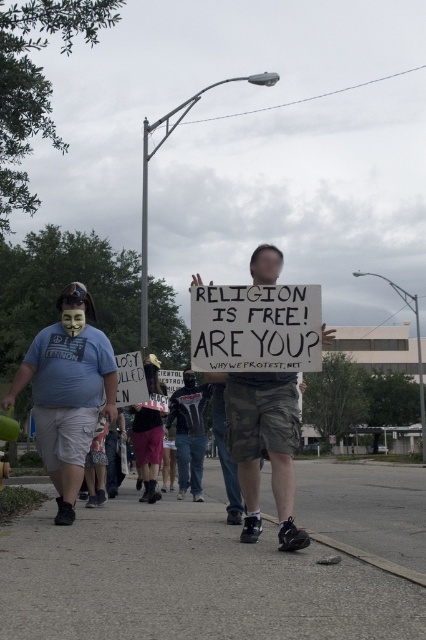
You are a photographer standing at the edge of the protest area. You want to capture a photo that includes both the gray asphalt pavement at lower center and the matte cardboard sign at center. Which object should you focus on first if you want both to be in sharp focus?

The gray asphalt pavement at lower center is larger in size than the matte cardboard sign at center, so focusing on the larger object first would ensure both are in sharp focus.

You are a photographer at the protest. You want to capture the matte cardboard sign at center without including the gray asphalt pavement at lower center in the frame. Is this possible?

The gray asphalt pavement at lower center is below the matte cardboard sign at center, so yes, the photographer can angle the camera upwards to focus on the matte cardboard sign at center while excluding the gray asphalt pavement at lower center from the shot.